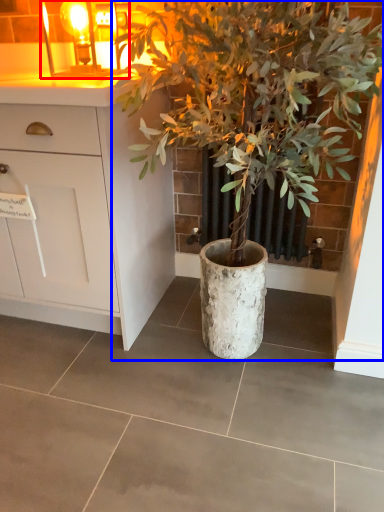
Question: Which object is further to the camera taking this photo, light fixture (highlighted by a red box) or houseplant (highlighted by a blue box)?

Choices:
 (A) light fixture
 (B) houseplant

Answer: (A)